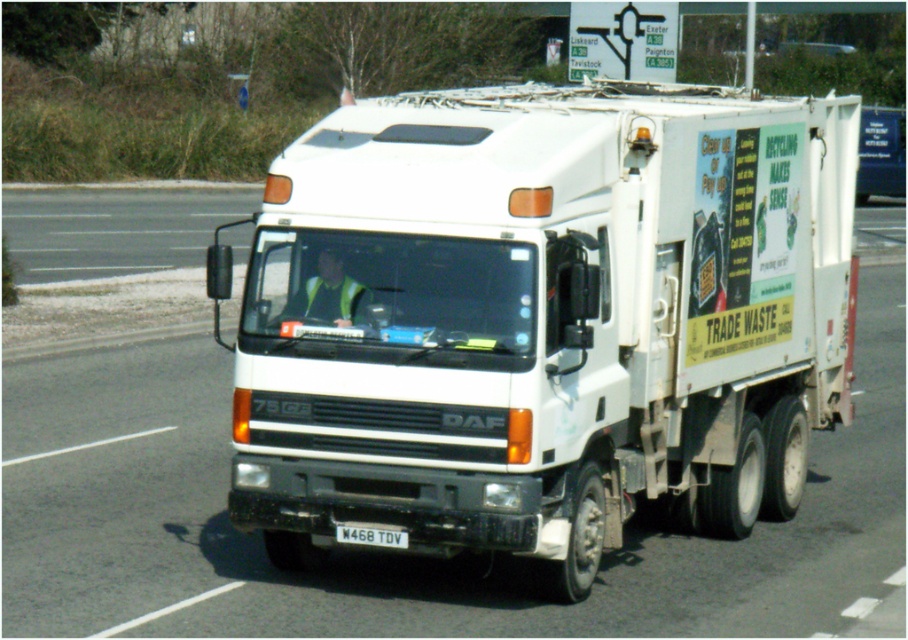
Is white matte truck at center taller than white plastic license plate at center?

Indeed, white matte truck at center has a greater height compared to white plastic license plate at center.

Image resolution: width=908 pixels, height=640 pixels. I want to click on white matte truck at center, so click(x=543, y=317).

At what (x,y) coordinates should I click in order to perform the action: click on white matte truck at center. Please return your answer as a coordinate pair (x, y). The width and height of the screenshot is (908, 640). Looking at the image, I should click on (543, 317).